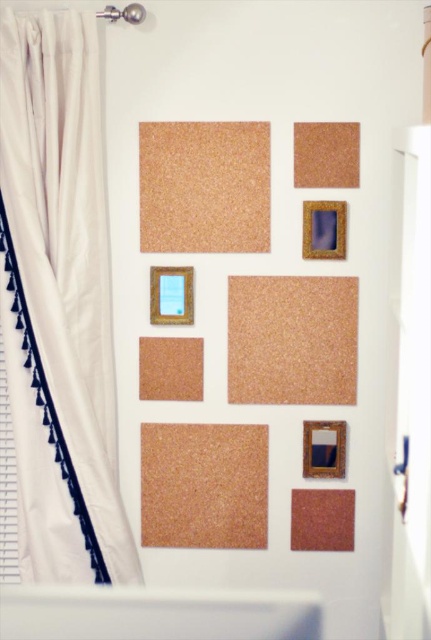
Question: Where is gold textured picture frame at center located in relation to gold metallic picture frame at lower right in the image?

Choices:
 (A) left
 (B) right

Answer: (A)

Question: Among these points, which one is nearest to the camera?

Choices:
 (A) (155, 301)
 (B) (324, 445)
 (C) (234, 202)

Answer: (C)

Question: Can you confirm if gold textured picture frame at center is bigger than gold metallic picture frame at lower right?

Choices:
 (A) no
 (B) yes

Answer: (B)

Question: Which of these objects is positioned closest to the gold textured picture frame at upper center?

Choices:
 (A) white fabric curtain at left
 (B) gold metallic picture frame at lower right
 (C) gold textured picture frame at center

Answer: (C)

Question: Which point is farther to the camera?

Choices:
 (A) (340, 252)
 (B) (325, 422)
 (C) (165, 275)
 (D) (72, 420)

Answer: (B)

Question: Is gold textured picture frame at upper center bigger than gold metallic picture frame at lower right?

Choices:
 (A) yes
 (B) no

Answer: (A)